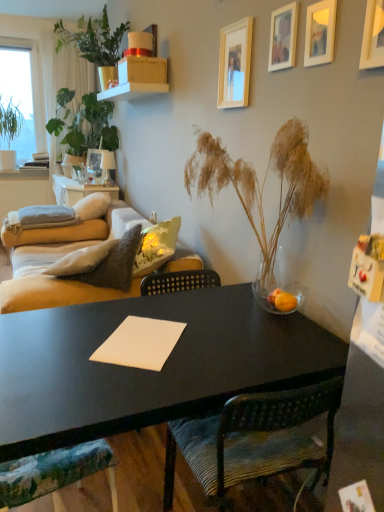
Question: From a real-world perspective, is gray fabric pillow at left, the second pillow viewed from the right, positioned above or below wooden picture frame at upper center, arranged as the 4th picture frame when viewed from the right?

Choices:
 (A) below
 (B) above

Answer: (A)

Question: Is gray fabric pillow at left, marked as the 1th pillow in a left-to-right arrangement, wider or thinner than wooden picture frame at upper center, positioned as the second picture frame in left-to-right order?

Choices:
 (A) thin
 (B) wide

Answer: (B)

Question: Which is nearer to the velvet beige couch at center-left?

Choices:
 (A) matte beige sofa at left
 (B) translucent glass vase at center, the 4th houseplant when ordered from left to right
 (C) white soft pillow at left, placed as the first pillow when sorted from right to left
 (D) green leafy plant at upper left, positioned as the second houseplant in front-to-back order
 (E) wooden picture frame at upper right, arranged as the 5th picture frame when viewed from the left

Answer: (B)

Question: Which is nearer to the translucent glass vase at center, the 4th houseplant when ordered from left to right?

Choices:
 (A) velvet beige couch at center-left
 (B) matte cardboard box at upper center
 (C) wooden picture frame at upper right, arranged as the fifth picture frame when viewed from the back
 (D) orange matte glass at center
 (E) green leafy plant at upper left, which is the second houseplant in right-to-left order

Answer: (D)